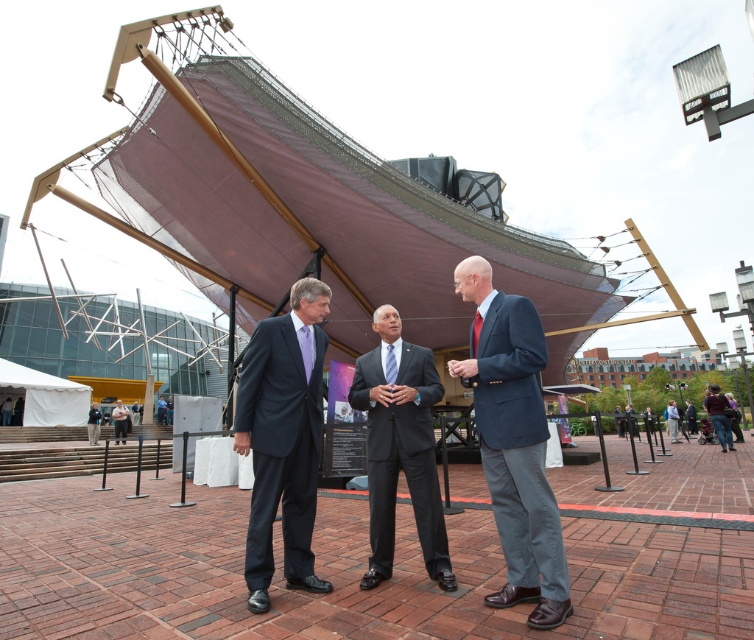
You are a photographer planning to take a group photo of the two men wearing the matte navy blazer at center and the dark blue suit at center. Since you want both subjects to appear equally tall in the photo, which man should you position closer to the camera?

You should position the man wearing the dark blue suit at center closer to the camera because the matte navy blazer at center is much taller than the dark blue suit at center. This adjustment will help balance their apparent heights in the photo.

Based on the photo, you are a photographer standing in front of the large modern structure. You notice two men wearing the matte black suit at center and the dark blue suit at center. Which of these two men is positioned higher in the image?

The matte black suit at center is positioned higher than the dark blue suit at center in the image.